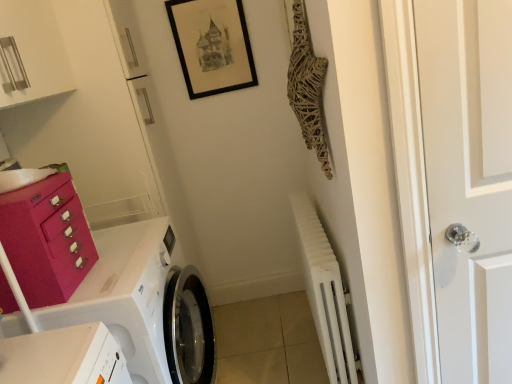
The height and width of the screenshot is (384, 512). In order to click on empty space that is ontop of white glossy washing machine at lower left in this screenshot , I will do `click(116, 258)`.